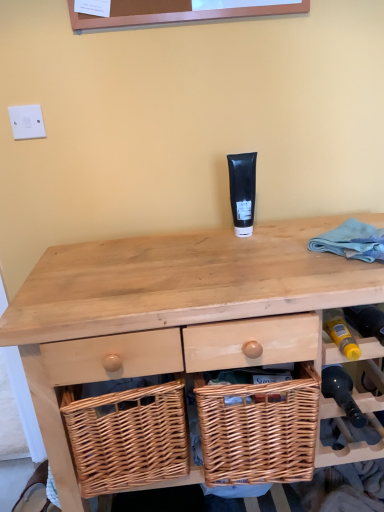
Question: Is the depth of black matte tube at center greater than that of white plastic switch at upper left?

Choices:
 (A) yes
 (B) no

Answer: (B)

Question: Is the depth of black matte tube at center less than that of white plastic switch at upper left?

Choices:
 (A) no
 (B) yes

Answer: (B)

Question: Is black matte tube at center taller than white plastic switch at upper left?

Choices:
 (A) no
 (B) yes

Answer: (B)

Question: Considering the relative positions of black matte tube at center and white plastic switch at upper left in the image provided, is black matte tube at center to the right of white plastic switch at upper left from the viewer's perspective?

Choices:
 (A) no
 (B) yes

Answer: (B)

Question: Does black matte tube at center have a lesser width compared to white plastic switch at upper left?

Choices:
 (A) no
 (B) yes

Answer: (A)

Question: From a real-world perspective, is natural wood desk at center physically located above or below white plastic switch at upper left?

Choices:
 (A) above
 (B) below

Answer: (B)

Question: In terms of height, does natural wood desk at center look taller or shorter compared to white plastic switch at upper left?

Choices:
 (A) short
 (B) tall

Answer: (B)

Question: In terms of size, does natural wood desk at center appear bigger or smaller than white plastic switch at upper left?

Choices:
 (A) big
 (B) small

Answer: (A)

Question: Is natural wood desk at center inside the boundaries of white plastic switch at upper left, or outside?

Choices:
 (A) outside
 (B) inside

Answer: (A)

Question: Is point (122, 339) positioned closer to the camera than point (369, 446)?

Choices:
 (A) closer
 (B) farther

Answer: (A)

Question: In the image, is natural wood desk at center on the left side or the right side of wooden wicker basket at lower right?

Choices:
 (A) left
 (B) right

Answer: (A)

Question: Looking at the image, does natural wood desk at center seem bigger or smaller compared to wooden wicker basket at lower right?

Choices:
 (A) small
 (B) big

Answer: (B)

Question: From a real-world perspective, is natural wood desk at center above or below wooden wicker basket at lower right?

Choices:
 (A) below
 (B) above

Answer: (A)

Question: Is white plastic switch at upper left taller or shorter than natural wood desk at center?

Choices:
 (A) short
 (B) tall

Answer: (A)

Question: Does point (x=13, y=117) appear closer or farther from the camera than point (x=77, y=270)?

Choices:
 (A) closer
 (B) farther

Answer: (B)